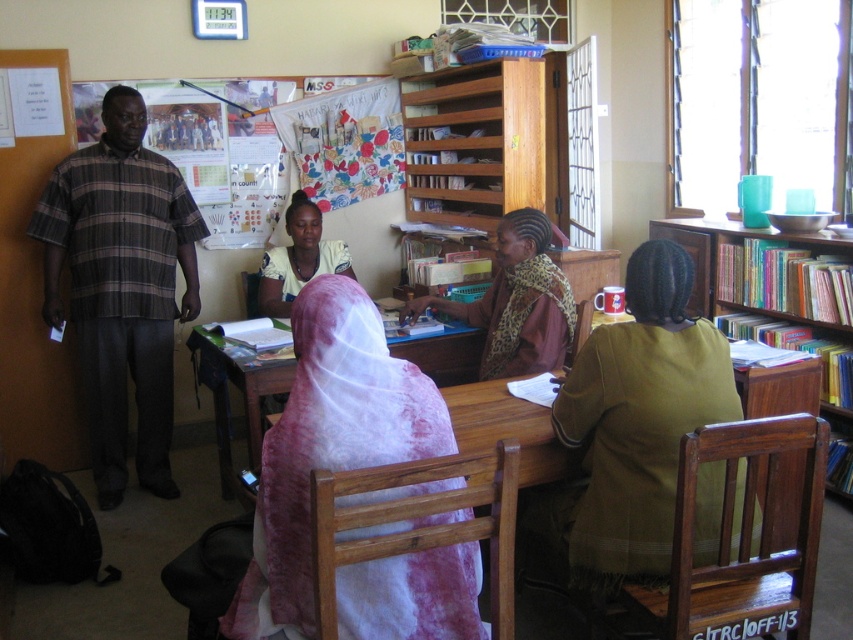
Measure the distance between wooden bookcase at right and leopard print scarf at center.

wooden bookcase at right and leopard print scarf at center are 1.18 meters apart.

Is wooden bookcase at right below leopard print scarf at center?

Yes, wooden bookcase at right is below leopard print scarf at center.

Is point (840, 486) closer to camera compared to point (503, 227)?

No, (840, 486) is further to viewer.

Locate an element on the screen. Image resolution: width=853 pixels, height=640 pixels. wooden bookcase at right is located at coordinates (779, 307).

Does plaid cotton shirt at left lie behind green fabric jacket at lower right?

Yes.

Is point (86, 154) farther from camera compared to point (634, 541)?

Yes, point (86, 154) is behind point (634, 541).

The width and height of the screenshot is (853, 640). In order to click on plaid cotton shirt at left in this screenshot , I will do `click(120, 285)`.

Identify the location of plaid cotton shirt at left. The image size is (853, 640). (120, 285).

Does green fabric jacket at lower right have a smaller size compared to matte white headscarf at center?

Incorrect, green fabric jacket at lower right is not smaller in size than matte white headscarf at center.

Who is lower down, green fabric jacket at lower right or matte white headscarf at center?

green fabric jacket at lower right is lower down.

Where is `green fabric jacket at lower right`? green fabric jacket at lower right is located at coordinates (639, 419).